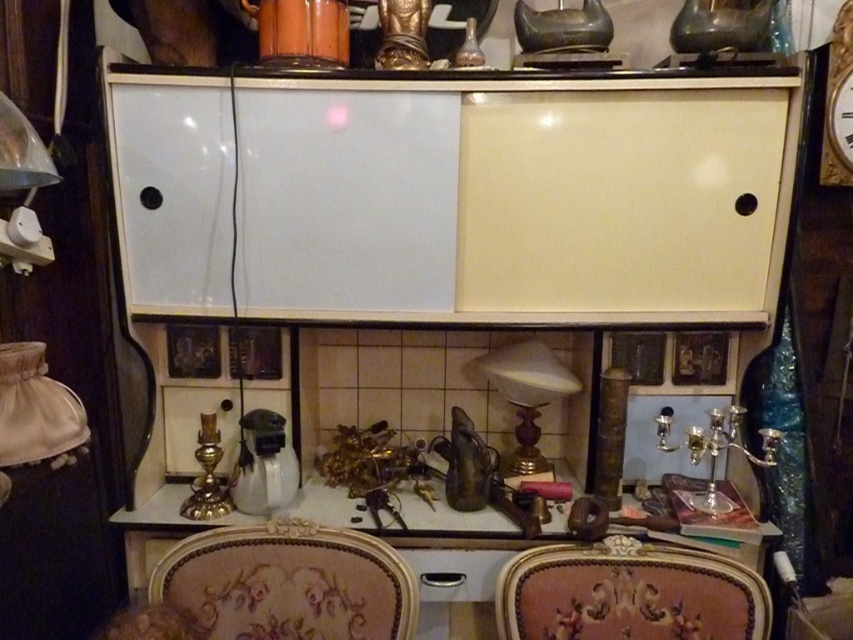
Between white satin lampshade at left and matte glass lamp at center, which one is positioned higher?

white satin lampshade at left is higher up.

Does white satin lampshade at left have a larger size compared to matte glass lamp at center?

Actually, white satin lampshade at left might be smaller than matte glass lamp at center.

Image resolution: width=853 pixels, height=640 pixels. In order to click on white satin lampshade at left in this screenshot , I will do `click(35, 413)`.

Does velvet upholstered chair at lower center have a greater width compared to metallic brass table at center?

In fact, velvet upholstered chair at lower center might be narrower than metallic brass table at center.

Can you confirm if velvet upholstered chair at lower center is smaller than metallic brass table at center?

Yes.

Is point (322, 600) positioned in front of point (456, 561)?

Yes, it is in front of point (456, 561).

Where is `velvet upholstered chair at lower center`? This screenshot has width=853, height=640. velvet upholstered chair at lower center is located at coordinates (288, 582).

Which is in front, point (672, 563) or point (827, 164)?

Point (672, 563) is in front.

Is point (596, 609) farther from viewer compared to point (845, 20)?

No, (596, 609) is in front of (845, 20).

Between point (704, 616) and point (828, 161), which one is positioned behind?

The point (828, 161) is more distant.

Where is `velvet floral chair at center`? velvet floral chair at center is located at coordinates (628, 595).